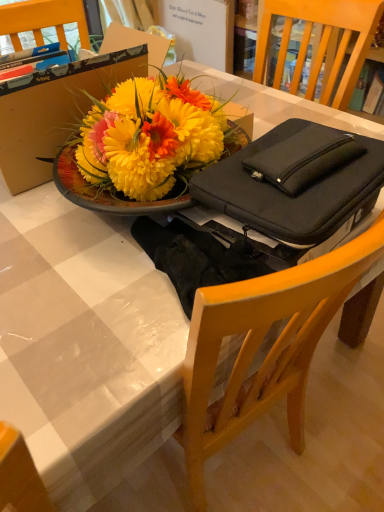
Describe the element at coordinates (54, 111) in the screenshot. I see `wooden bowl at upper left` at that location.

Locate an element on the screen. wooden bowl at upper left is located at coordinates (54, 111).

Where is `wooden bowl at upper left`? This screenshot has width=384, height=512. wooden bowl at upper left is located at coordinates (54, 111).